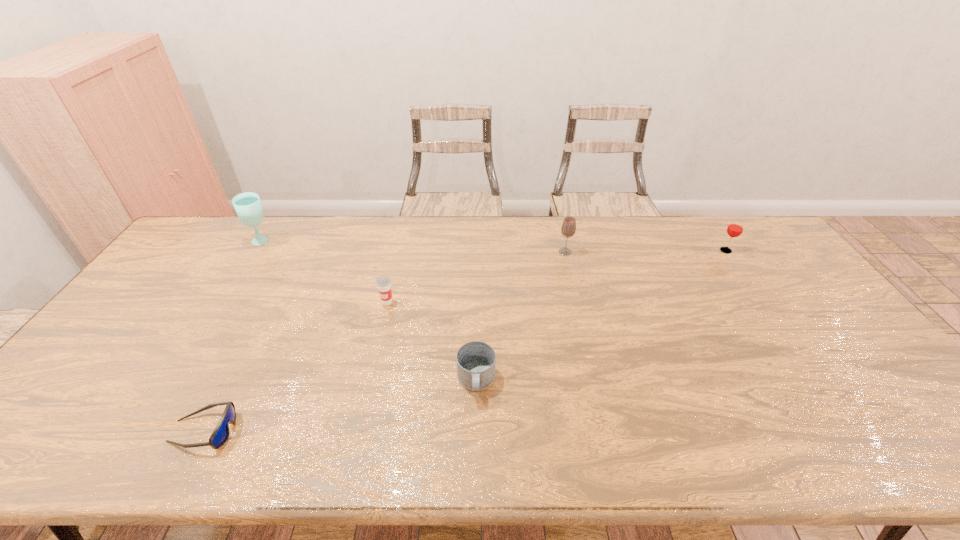
Locate an element on the screen. free space that is in between the fourth object from left to right and the fourth farthest object is located at coordinates [432, 341].

Find the location of a particular element. This screenshot has width=960, height=540. blank region between the fourth object from right to left and the fifth object from left to right is located at coordinates (476, 277).

Find the location of `vacant area that lies between the leftmost glass and the cup`. vacant area that lies between the leftmost glass and the cup is located at coordinates (324, 272).

This screenshot has height=540, width=960. In order to click on object that can be found as the fifth closest to the fifth farthest object in this screenshot , I will do `click(735, 228)`.

Identify the location of object that is the third closest to the mug. (220, 434).

This screenshot has width=960, height=540. I want to click on glass that is the third nearest to the third object from right to left, so 735,228.

Select which glass appears as the second closest to the fourth object from left to right. Please provide its 2D coordinates. Your answer should be formatted as a tuple, i.e. [(x, y)], where the tuple contains the x and y coordinates of a point satisfying the conditions above.

[(248, 207)]

The height and width of the screenshot is (540, 960). I want to click on free point that satisfies the following two spatial constraints: 1. on the side of the fourth farthest object with the logo; 2. on the front-facing side of the nearest object, so click(x=358, y=431).

This screenshot has width=960, height=540. I want to click on free spot that satisfies the following two spatial constraints: 1. on the side of the fifth tallest object with the handle; 2. on the front-facing side of the sunglasses, so click(476, 431).

Identify the location of vacant point that satisfies the following two spatial constraints: 1. on the side of the third object from left to right with the logo; 2. on the front-facing side of the shortest object. The height and width of the screenshot is (540, 960). (358, 431).